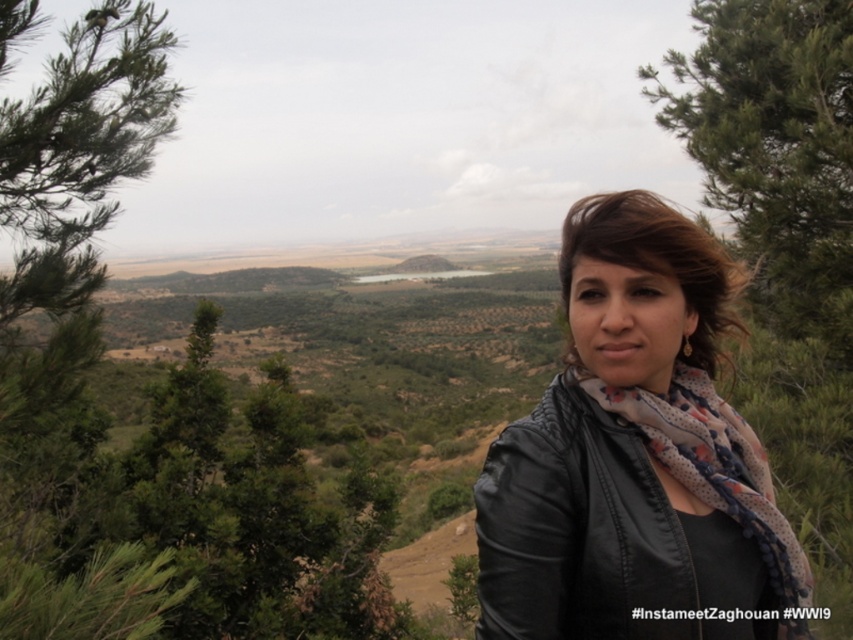
Is point (782, 220) closer to viewer compared to point (643, 392)?

No, it is not.

Is point (730, 141) positioned after point (666, 467)?

Yes, it is.

Image resolution: width=853 pixels, height=640 pixels. I want to click on green leafy tree at upper right, so click(x=775, y=148).

Can you confirm if matte black jacket at center is positioned to the left of green leafy tree at upper right?

Indeed, matte black jacket at center is positioned on the left side of green leafy tree at upper right.

Consider the image. Which is more to the right, matte black jacket at center or green leafy tree at upper right?

green leafy tree at upper right is more to the right.

Locate an element on the screen. matte black jacket at center is located at coordinates (635, 454).

This screenshot has width=853, height=640. Find the location of `matte black jacket at center`. matte black jacket at center is located at coordinates (635, 454).

I want to click on matte black jacket at center, so click(635, 454).

Who is more forward, (578, 291) or (752, 461)?

Point (578, 291)

Does point (573, 500) come farther from viewer compared to point (801, 632)?

No, it is in front of (801, 632).

Locate an element on the screen. This screenshot has height=640, width=853. matte black jacket at center is located at coordinates (635, 454).